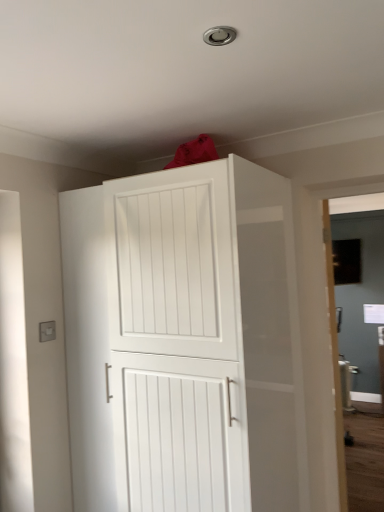
The height and width of the screenshot is (512, 384). What are the coordinates of `white glossy cupboard at upper center` in the screenshot? It's located at (181, 340).

This screenshot has width=384, height=512. What do you see at coordinates (181, 340) in the screenshot?
I see `white glossy cupboard at upper center` at bounding box center [181, 340].

Locate an element on the screen. white glossy cupboard at upper center is located at coordinates (181, 340).